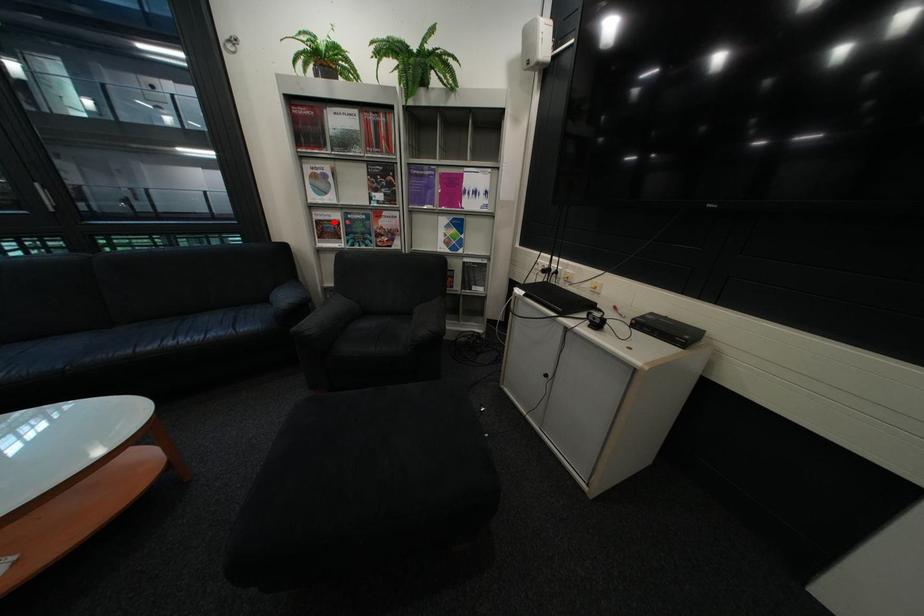
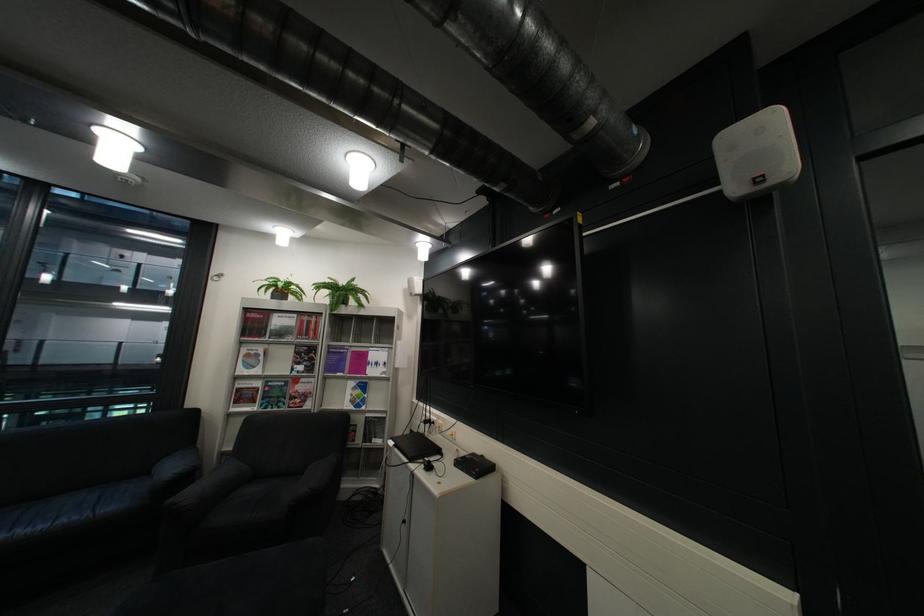
Question: I am providing you with two images of the same scene from different viewpoints. Given a red point in image1, look at the same physical point in image2. Is it:

Choices:
 (A) Closer to the viewpoint
 (B) Farther from the viewpoint

Answer: (B)